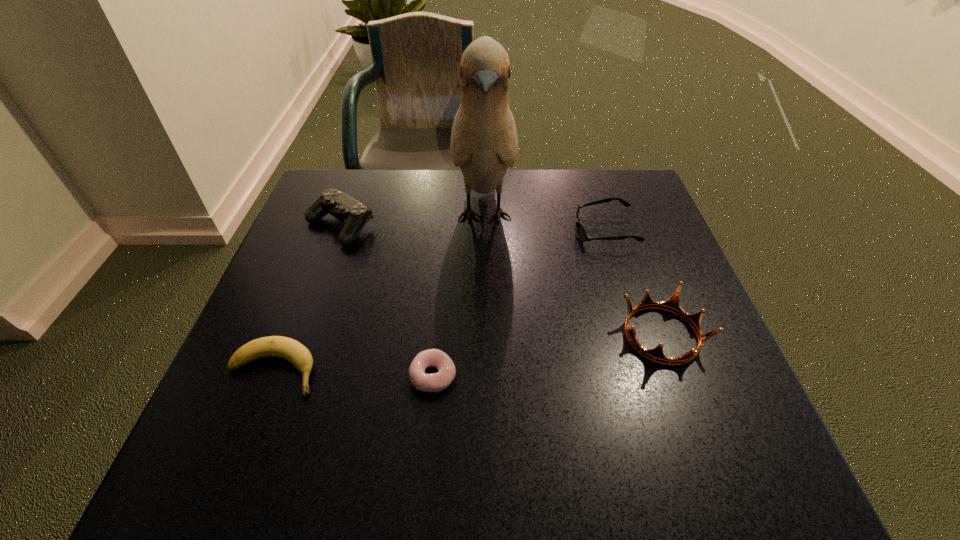
You are a GUI agent. You are given a task and a screenshot of the screen. Output one action in this format:
    pyautogui.click(x=<x>, y=<y>)
    Task: Click on the object that ranks as the third closest to the sunglasses
    This screenshot has height=540, width=960.
    Given the screenshot: What is the action you would take?
    pyautogui.click(x=435, y=382)

Choose which object is the fourth nearest neighbor to the doughnut. Please provide its 2D coordinates. Your answer should be formatted as a tuple, i.e. [(x, y)], where the tuple contains the x and y coordinates of a point satisfying the conditions above.

[(354, 214)]

Where is `free location that satisfies the following two spatial constraints: 1. on the front side of the crown; 2. on the left side of the control`? free location that satisfies the following two spatial constraints: 1. on the front side of the crown; 2. on the left side of the control is located at coordinates (301, 334).

This screenshot has width=960, height=540. I want to click on free space in the image that satisfies the following two spatial constraints: 1. on the lenses of the crown; 2. on the right side of the sunglasses, so click(x=637, y=334).